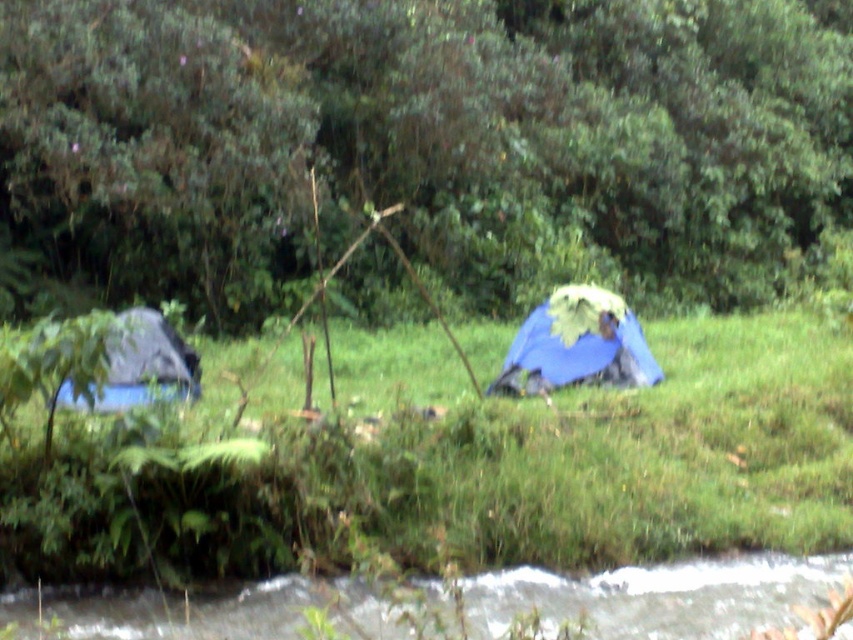
You are standing at the origin point of the image. Where is the green leafy tree at upper center located in terms of coordinates?

The green leafy tree at upper center is located at coordinates point (x=422, y=145).